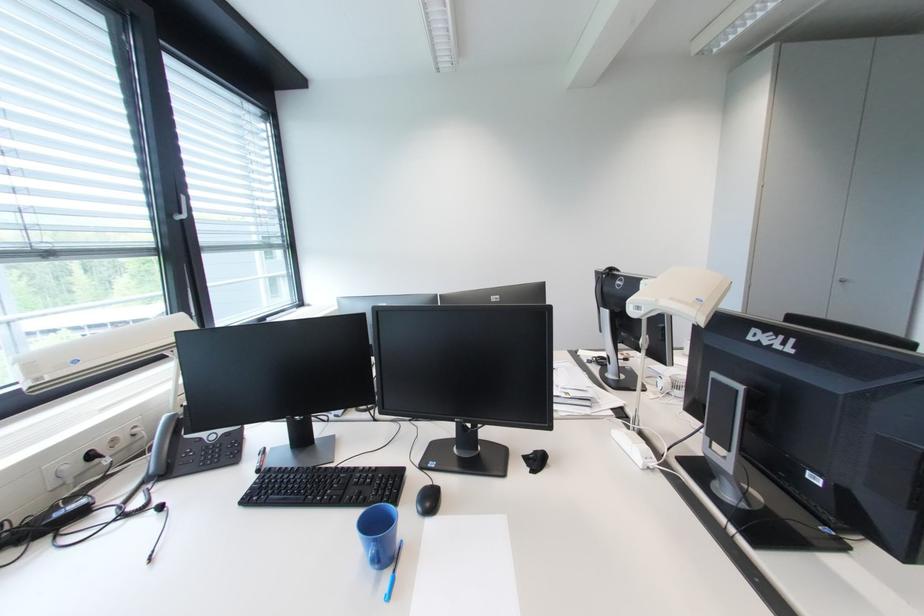
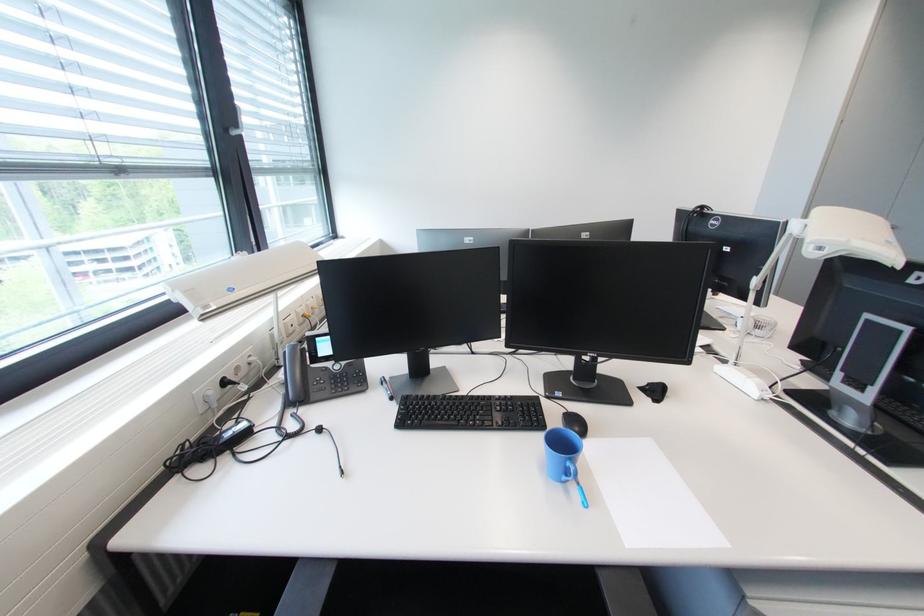
Locate, in the second image, the point that corresponds to pixel 178 419 in the first image.

(300, 349)